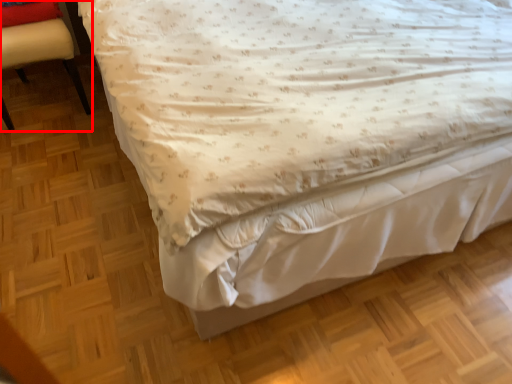
Question: From the image's perspective, what is the correct spatial positioning of chair (annotated by the red box) in reference to pillow?

Choices:
 (A) above
 (B) below

Answer: (B)